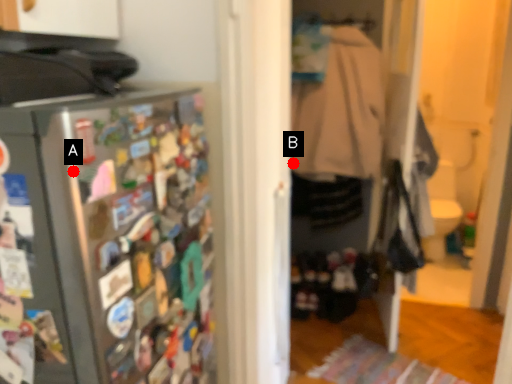
Question: Two points are circled on the image, labeled by A and B beside each circle. Among these points, which one is nearest to the camera?

Choices:
 (A) A is closer
 (B) B is closer

Answer: (A)